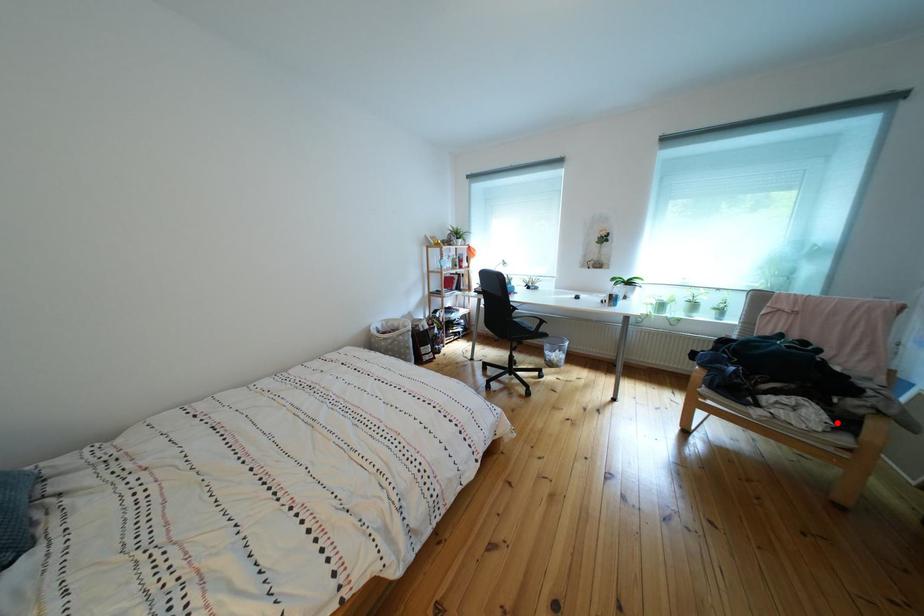
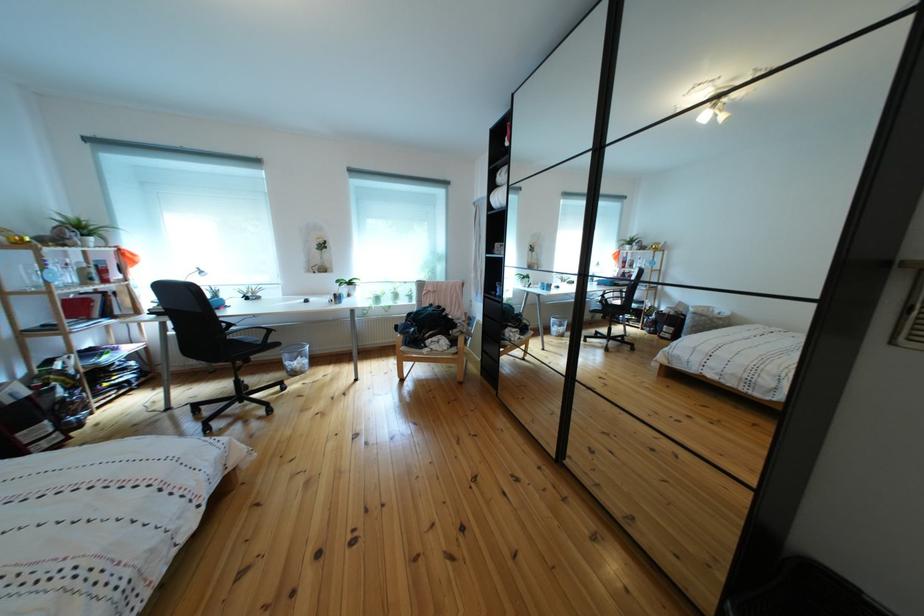
In the second image, find the point that corresponds to the highlighted location in the first image.

(458, 347)